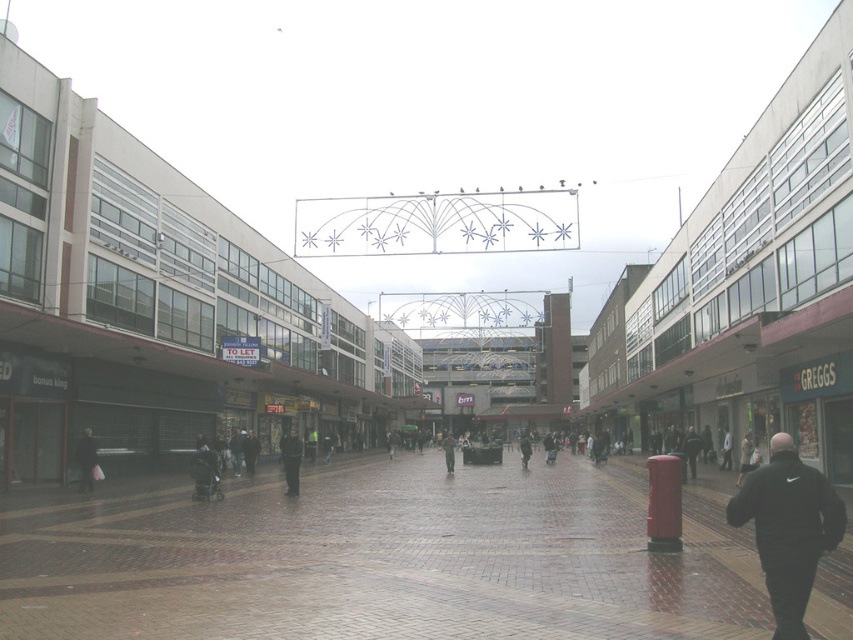
Question: In this image, where is black matte jacket at lower right located relative to dark blue jeans at center?

Choices:
 (A) above
 (B) below

Answer: (A)

Question: Which object is positioned farthest from the black matte jacket at lower right?

Choices:
 (A) brick pavement at center
 (B) dark gray jacket at lower left

Answer: (B)

Question: Estimate the real-world distances between objects in this image. Which object is farther from the dark gray jacket at center?

Choices:
 (A) dark gray jacket at lower left
 (B) dark blue jeans at center

Answer: (B)

Question: Which point is closer to the camera taking this photo?

Choices:
 (A) (90, 472)
 (B) (448, 461)

Answer: (A)

Question: Is dark blue jeans at center positioned at the back of dark gray jacket at center?

Choices:
 (A) yes
 (B) no

Answer: (B)

Question: Is brick pavement at center below dark blue jeans at center?

Choices:
 (A) yes
 (B) no

Answer: (B)